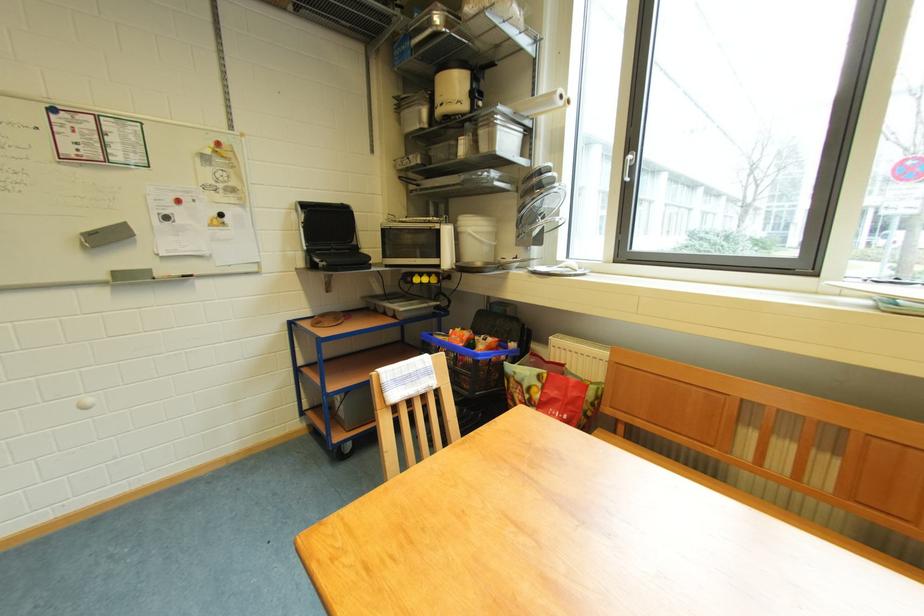
I want to click on white plastic bucket, so click(x=476, y=238).